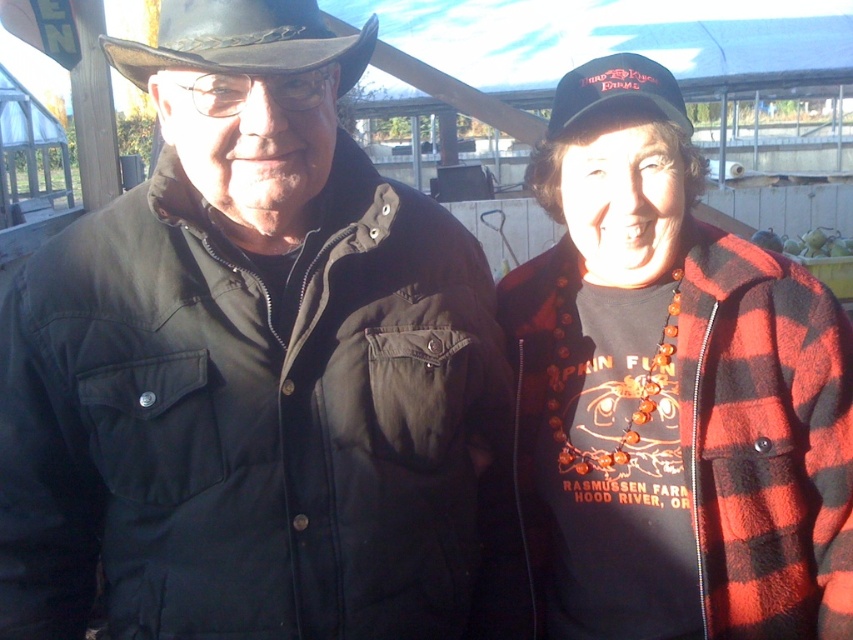
You are a photographer taking a picture of the red plaid jacket at right and the black fabric baseball cap at upper right. Which object should you focus on first to ensure both are in sharp focus?

You should focus on the red plaid jacket at right first because it is closer to the viewer than the black fabric baseball cap at upper right, so adjusting focus from near to far will help both be in sharp focus.

What are the coordinates of the red plaid jacket at right?

The coordinates of the red plaid jacket at right are at point (671, 394).

You are a photographer setting up for a group photo and notice the red plaid jacket at right and the black fabric baseball cap at upper right. How far apart are these two items in inches?

The red plaid jacket at right is 13.21 inches from the black fabric baseball cap at upper right.